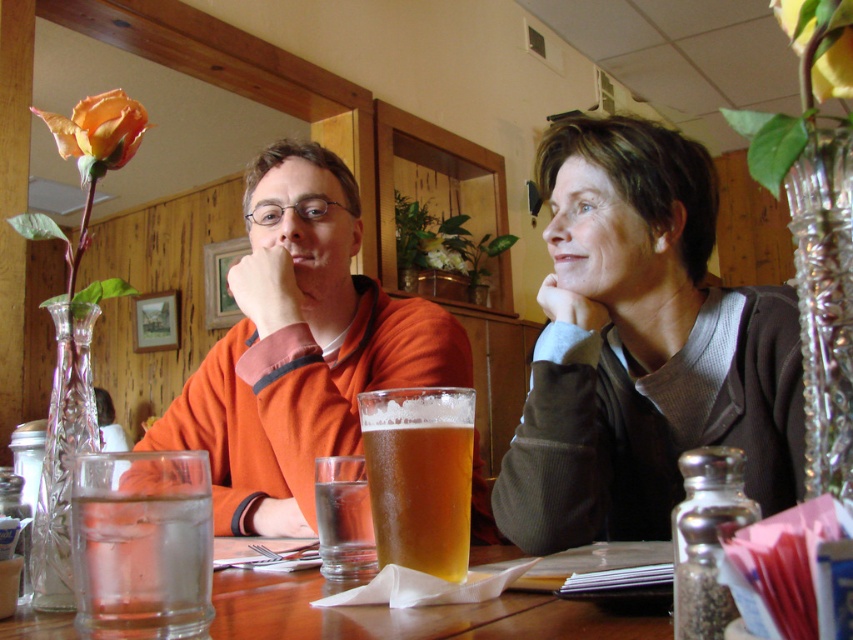
You are taking a photo of the two people seated at the wooden table. You want to focus on the point closer to the camera between the two points marked as point (770,412) and point (712,429). Which point should you focus on?

You should focus on point (770,412) because it is closer to the camera than point (712,429) according to the coordinates provided.

You are a photographer standing at a distance of 30 inches from the scene. You want to take a closeup shot of the matte orange sweater at center without moving the camera. Is the sweater within your current camera frame?

The matte orange sweater at center is 32.51 inches away from the viewer, which is farther than your current distance of 30 inches. Therefore, the sweater is slightly out of reach for a closeup without moving the camera.